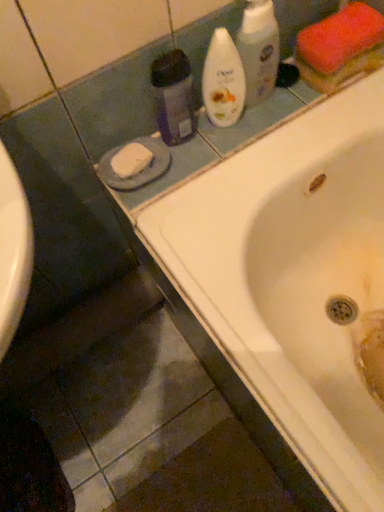
Question: Is white glossy bottle at upper center, marked as the 2th cleaning product in a right-to-left arrangement, taller than white glossy bathtub at upper center?

Choices:
 (A) no
 (B) yes

Answer: (A)

Question: From the image's perspective, is white glossy bottle at upper center, marked as the 2th cleaning product in a right-to-left arrangement, on top of white glossy bathtub at upper center?

Choices:
 (A) yes
 (B) no

Answer: (A)

Question: Does white glossy bottle at upper center, marked as the 2th cleaning product in a right-to-left arrangement, have a larger size compared to white glossy bathtub at upper center?

Choices:
 (A) no
 (B) yes

Answer: (A)

Question: Is white glossy bottle at upper center, which is the 2th cleaning product in left-to-right order, not inside white glossy bathtub at upper center?

Choices:
 (A) no
 (B) yes

Answer: (B)

Question: Is white glossy bottle at upper center, which is the 2th cleaning product in left-to-right order, to the right of white glossy bathtub at upper center from the viewer's perspective?

Choices:
 (A) no
 (B) yes

Answer: (A)

Question: From a real-world perspective, is white glossy bathtub at upper center physically located above or below white glossy bottle at upper center, which appears as the 1th cleaning product when viewed from the right?

Choices:
 (A) below
 (B) above

Answer: (A)

Question: Does point (314, 150) appear closer or farther from the camera than point (248, 29)?

Choices:
 (A) closer
 (B) farther

Answer: (B)

Question: Is white glossy bathtub at upper center spatially inside white glossy bottle at upper center, which ranks as the third cleaning product in left-to-right order, or outside of it?

Choices:
 (A) inside
 (B) outside

Answer: (B)

Question: Looking at their shapes, would you say white glossy bathtub at upper center is wider or thinner than white glossy bottle at upper center, which ranks as the third cleaning product in left-to-right order?

Choices:
 (A) thin
 (B) wide

Answer: (B)

Question: Considering the positions of white glossy bottle at upper center, which is the 2th cleaning product in left-to-right order, and white glossy bathtub at upper center in the image, is white glossy bottle at upper center, which is the 2th cleaning product in left-to-right order, taller or shorter than white glossy bathtub at upper center?

Choices:
 (A) tall
 (B) short

Answer: (B)

Question: In terms of width, does white glossy bottle at upper center, which is the 2th cleaning product in left-to-right order, look wider or thinner when compared to white glossy bathtub at upper center?

Choices:
 (A) wide
 (B) thin

Answer: (B)

Question: From a real-world perspective, is white glossy bottle at upper center, marked as the 2th cleaning product in a right-to-left arrangement, positioned above or below white glossy bathtub at upper center?

Choices:
 (A) above
 (B) below

Answer: (A)

Question: Considering the positions of point (203, 92) and point (251, 313), is point (203, 92) closer or farther from the camera than point (251, 313)?

Choices:
 (A) farther
 (B) closer

Answer: (A)

Question: Considering the positions of white glossy bathtub at upper center and white glossy bottle at upper center, which is the 2th cleaning product in left-to-right order, in the image, is white glossy bathtub at upper center bigger or smaller than white glossy bottle at upper center, which is the 2th cleaning product in left-to-right order,?

Choices:
 (A) big
 (B) small

Answer: (A)

Question: In terms of height, does white glossy bathtub at upper center look taller or shorter compared to white glossy bottle at upper center, marked as the 2th cleaning product in a right-to-left arrangement?

Choices:
 (A) short
 (B) tall

Answer: (B)